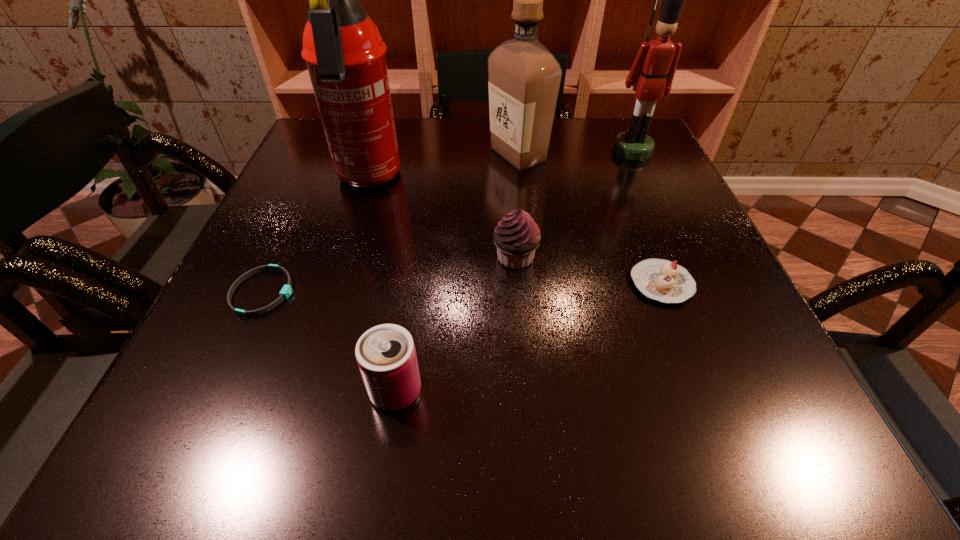
This screenshot has width=960, height=540. What are the coordinates of `vacant position in the image that satisfies the following two spatial constraints: 1. on the front-facing side of the liquor; 2. on the right side of the second shortest object` in the screenshot? It's located at (533, 284).

Where is `free space that satisfies the following two spatial constraints: 1. on the buckle of the can; 2. on the right side of the shortest object`? The image size is (960, 540). free space that satisfies the following two spatial constraints: 1. on the buckle of the can; 2. on the right side of the shortest object is located at coordinates (218, 391).

Find the location of a particular element. The height and width of the screenshot is (540, 960). vacant area that satisfies the following two spatial constraints: 1. on the back side of the right cupcake; 2. on the right side of the can is located at coordinates pos(412,284).